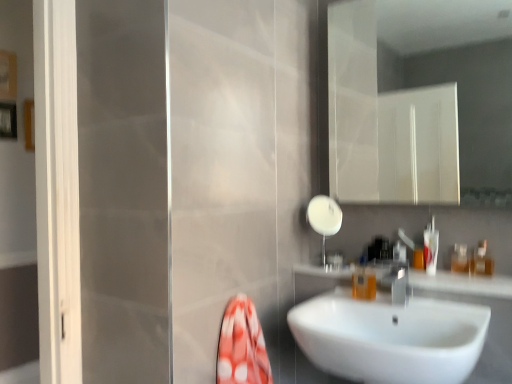
Question: Do you think white glossy sink at center is within translucent plastic bottle at right, which is counted as the third toiletry, starting from the left, or outside of it?

Choices:
 (A) inside
 (B) outside

Answer: (B)

Question: In terms of width, does white glossy sink at center look wider or thinner when compared to translucent plastic bottle at right, which is counted as the third toiletry, starting from the left?

Choices:
 (A) wide
 (B) thin

Answer: (A)

Question: Which object is positioned farthest from the white glossy shower at upper center?

Choices:
 (A) white glossy sink at center
 (B) silver metallic tap at sink right
 (C) translucent plastic container at right, arranged as the second toiletry when viewed from the left
 (D) white glossy sink at center
 (E) translucent plastic bottle at right, the third toiletry viewed from the right

Answer: (C)

Question: Estimate the real-world distances between objects in this image. Which object is farther from the translucent plastic bottle at right, the third toiletry viewed from the right?

Choices:
 (A) silver metallic tap at sink right
 (B) translucent plastic container at right, marked as the second toiletry in a right-to-left arrangement
 (C) translucent plastic bottle at right, which is counted as the third toiletry, starting from the left
 (D) white glossy shower at upper center
 (E) white glossy sink at center

Answer: (C)